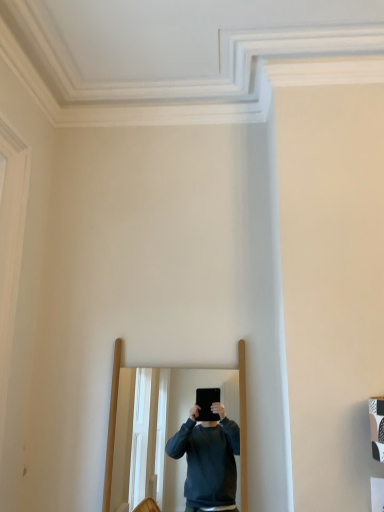
This screenshot has height=512, width=384. What do you see at coordinates (159, 430) in the screenshot? I see `matte black tablet at center` at bounding box center [159, 430].

The image size is (384, 512). Find the location of `matte black tablet at center`. matte black tablet at center is located at coordinates (159, 430).

Locate an element on the screen. The height and width of the screenshot is (512, 384). matte black tablet at center is located at coordinates (159, 430).